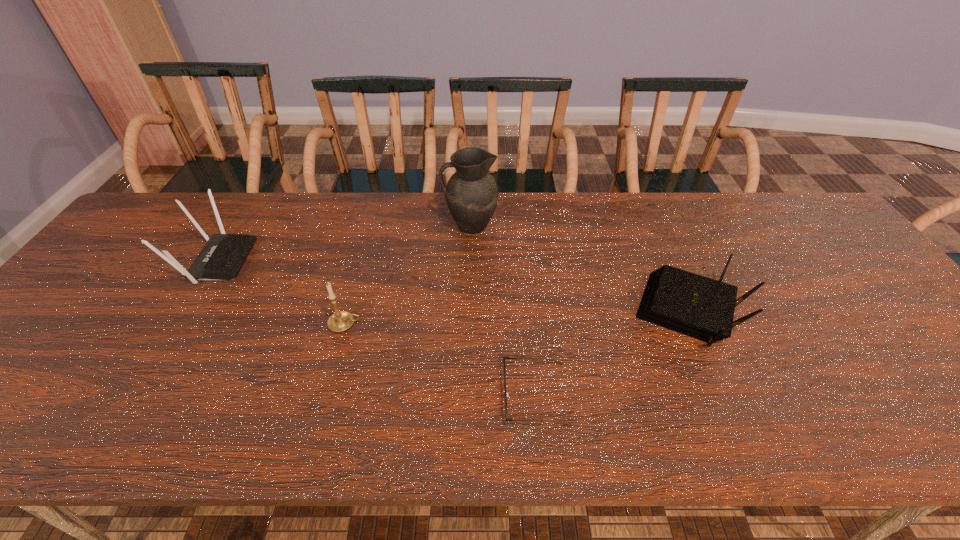
At what (x,y) coordinates should I click in order to perform the action: click on free space at the far edge. Please return your answer as a coordinate pair (x, y). The height and width of the screenshot is (540, 960). Looking at the image, I should click on (636, 204).

This screenshot has width=960, height=540. Identify the location of vacant space at the near edge of the desktop. (533, 443).

This screenshot has width=960, height=540. What are the coordinates of `free space at the right edge` in the screenshot? It's located at (889, 341).

Find the location of a particular element. vacant area at the far left corner of the desktop is located at coordinates (130, 238).

Locate an element on the screen. The height and width of the screenshot is (540, 960). free space between the shortest object and the second shortest object is located at coordinates click(612, 353).

At what (x,y) coordinates should I click in order to perform the action: click on free space between the spectacles and the shorter router. Please return your answer as a coordinate pair (x, y). The width and height of the screenshot is (960, 540). Looking at the image, I should click on (612, 353).

Identify the location of free space between the pitcher and the second object from left to right. (408, 275).

What are the coordinates of `free area in between the taller router and the pitcher` in the screenshot? It's located at (344, 244).

You are a GUI agent. You are given a task and a screenshot of the screen. Output one action in this format:
    pyautogui.click(x=<x>, y=<y>)
    Task: Click on the vacant region between the pitcher and the second object from left to right
    This screenshot has width=960, height=540.
    Given the screenshot: What is the action you would take?
    pyautogui.click(x=408, y=275)

The image size is (960, 540). Find the location of `free area in between the fourth object from right to left and the second shortest object`. free area in between the fourth object from right to left and the second shortest object is located at coordinates pyautogui.click(x=517, y=318).